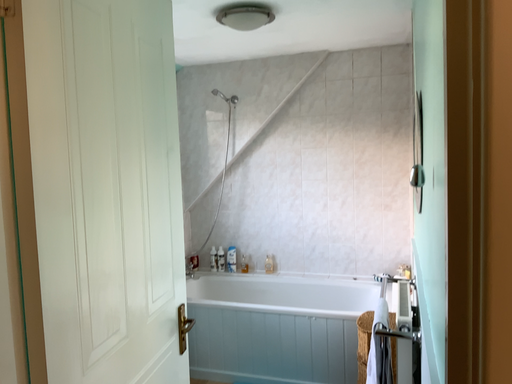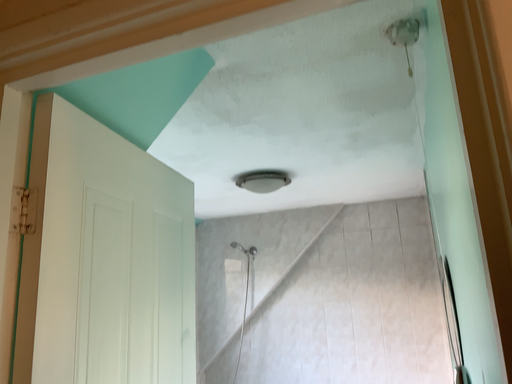
Question: How did the camera likely rotate when shooting the video?

Choices:
 (A) rotated downward
 (B) rotated upward

Answer: (B)